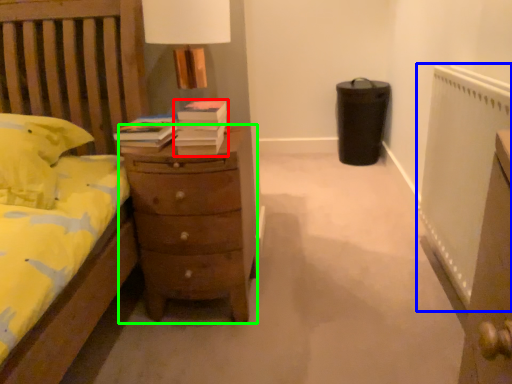
Question: Considering the real-world distances, which object is closest to book (highlighted by a red box)? radiator (highlighted by a blue box) or chest of drawers (highlighted by a green box).

Choices:
 (A) radiator
 (B) chest of drawers

Answer: (B)